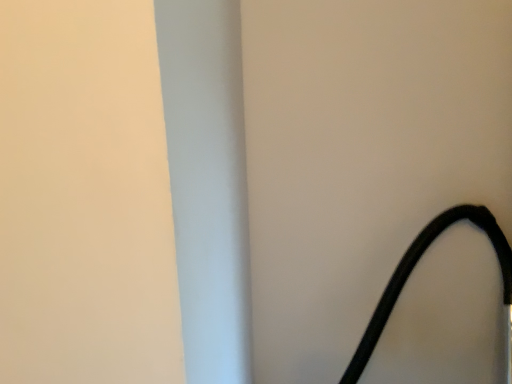
The image size is (512, 384). Find the location of `black rubber door handle at lower right`. black rubber door handle at lower right is located at coordinates (412, 270).

This screenshot has width=512, height=384. Describe the element at coordinates (412, 270) in the screenshot. I see `black rubber door handle at lower right` at that location.

This screenshot has width=512, height=384. In order to click on black rubber door handle at lower right in this screenshot , I will do `click(412, 270)`.